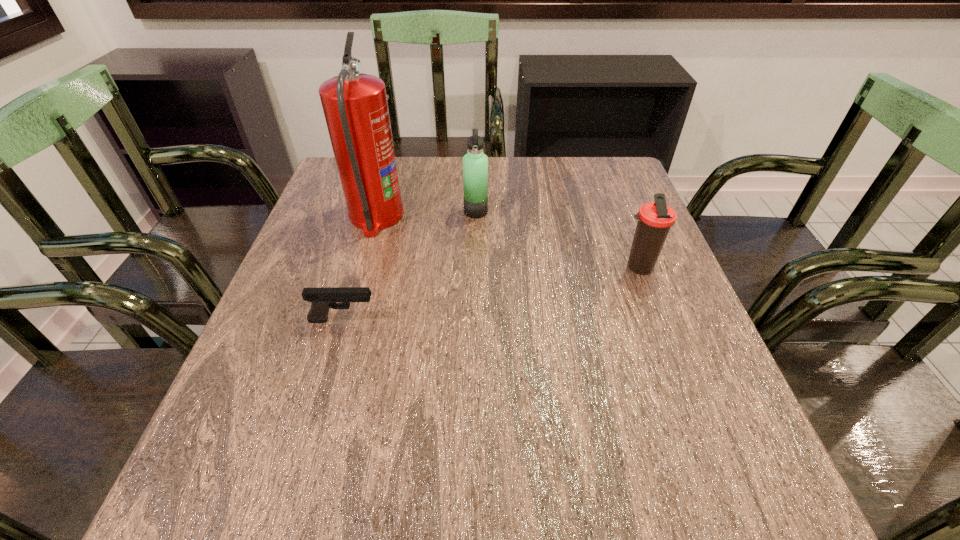
Where is `vacant space at the far right corner of the desktop`? The image size is (960, 540). vacant space at the far right corner of the desktop is located at coordinates [599, 177].

Where is `free spot between the third tallest object and the third shortest object`? This screenshot has height=540, width=960. free spot between the third tallest object and the third shortest object is located at coordinates (557, 240).

Find the location of `empty location between the tallest object and the pistol`. empty location between the tallest object and the pistol is located at coordinates (359, 268).

The height and width of the screenshot is (540, 960). Find the location of `vacant space in between the fire extinguisher and the nearest object`. vacant space in between the fire extinguisher and the nearest object is located at coordinates (359, 268).

You are a GUI agent. You are given a task and a screenshot of the screen. Output one action in this format:
    pyautogui.click(x=<x>, y=<y>)
    Task: Click on the unoccupied position between the farther thermos bottle and the pistol
    
    Given the screenshot: What is the action you would take?
    pyautogui.click(x=409, y=266)

Identify the location of free space between the shortest object and the tallest object. The image size is (960, 540). (359, 268).

The image size is (960, 540). Identify the location of unoccupied area between the second tallest object and the fire extinguisher. (426, 214).

I want to click on empty location between the nearest object and the fire extinguisher, so click(x=359, y=268).

I want to click on vacant space that's between the fire extinguisher and the rightmost object, so click(x=507, y=242).

You are a GUI agent. You are given a task and a screenshot of the screen. Output one action in this format:
    pyautogui.click(x=<x>, y=<y>)
    Task: Click on the vacant area that lies between the second nearest object and the pistol
    
    Given the screenshot: What is the action you would take?
    pyautogui.click(x=491, y=294)